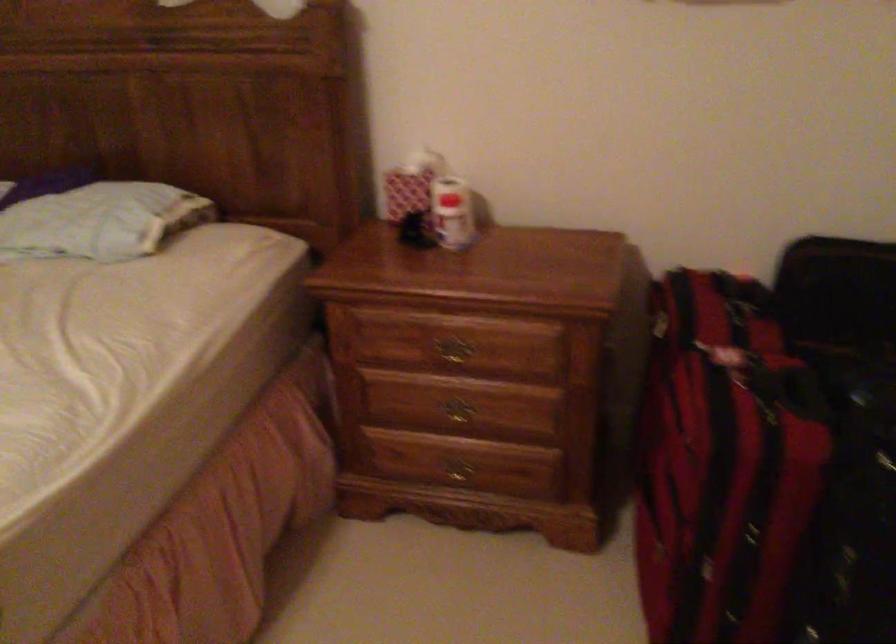
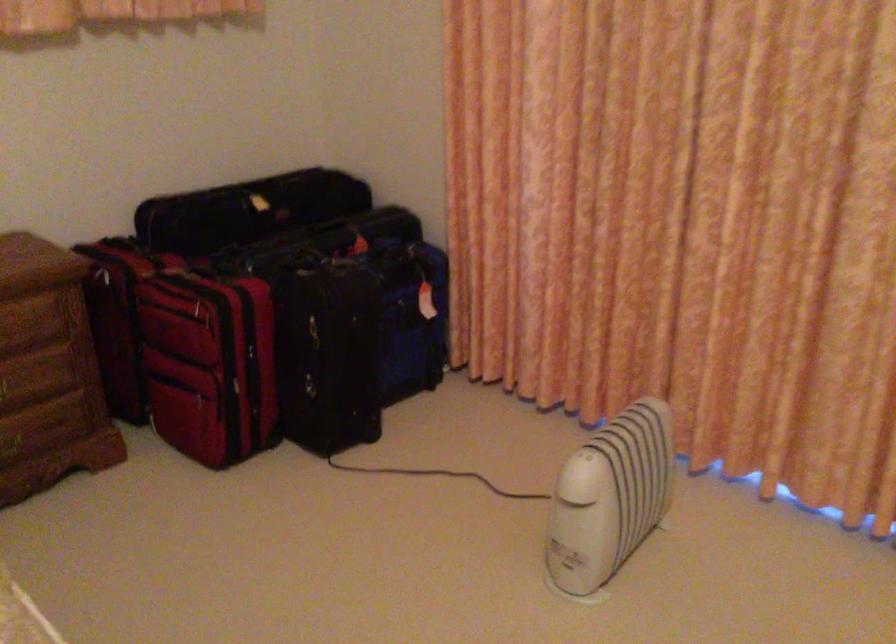
The point at (677,509) is marked in the first image. Where is the corresponding point in the second image?

(209, 364)